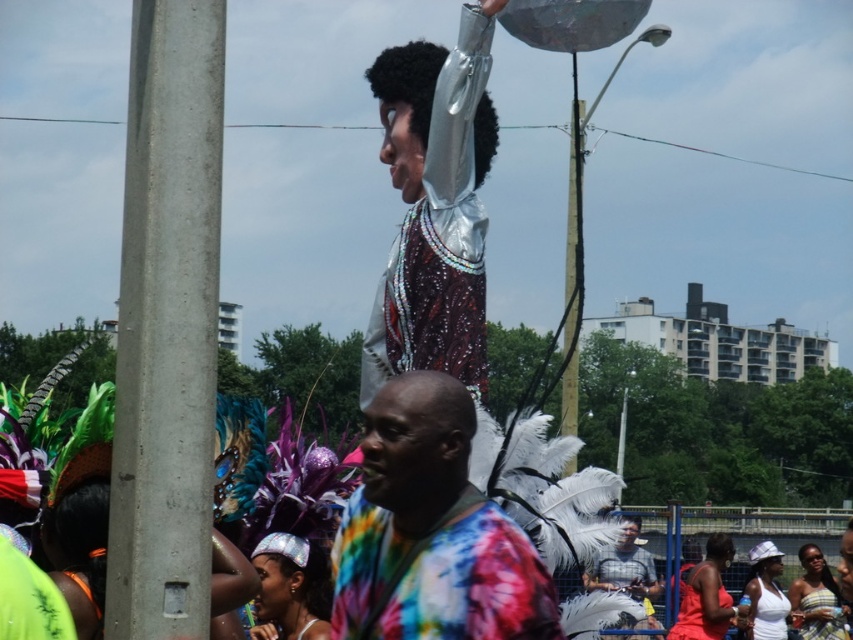
Which is above, patterned fabric headdress at center or white matte tank top at lower right?

white matte tank top at lower right is higher up.

Which is below, patterned fabric headdress at center or white matte tank top at lower right?

Positioned lower is patterned fabric headdress at center.

Between point (822, 637) and point (770, 595), which one is positioned in front?

Point (822, 637) is more forward.

I want to click on patterned fabric headdress at center, so [821, 614].

Does shiny metallic costume at center have a greater width compared to gray cotton shirt at center?

Incorrect, shiny metallic costume at center's width does not surpass gray cotton shirt at center's.

Is point (387, 336) positioned after point (628, 516)?

No, it is in front of (628, 516).

The width and height of the screenshot is (853, 640). In order to click on shiny metallic costume at center in this screenshot , I will do `click(434, 209)`.

Who is more forward, (453, 173) or (689, 624)?

Point (453, 173) is more forward.

Which of these two, shiny metallic costume at center or matte pink tank top at lower right, stands taller?

With more height is shiny metallic costume at center.

This screenshot has width=853, height=640. What do you see at coordinates (434, 209) in the screenshot? I see `shiny metallic costume at center` at bounding box center [434, 209].

The width and height of the screenshot is (853, 640). In order to click on shiny metallic costume at center in this screenshot , I will do (x=434, y=209).